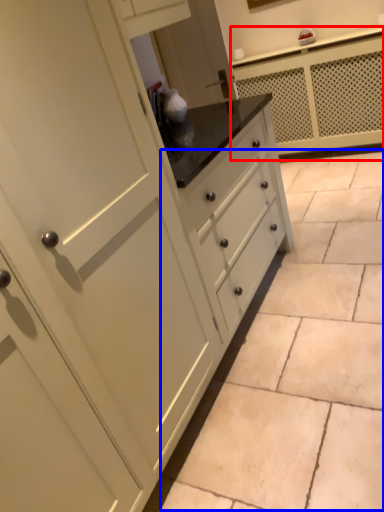
Question: Which object is closer to the camera taking this photo, counter (highlighted by a red box) or ceramic tile (highlighted by a blue box)?

Choices:
 (A) counter
 (B) ceramic tile

Answer: (B)